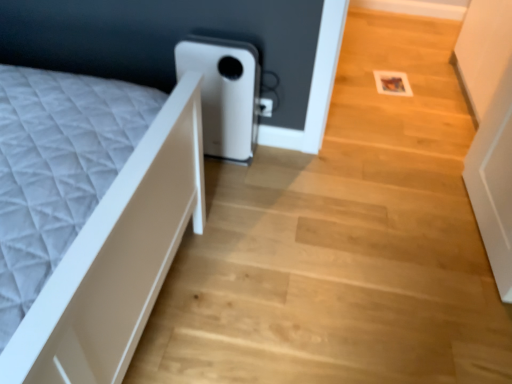
Describe the element at coordinates (343, 242) in the screenshot. I see `wooden floor at center` at that location.

Find the location of a particular element. wooden floor at center is located at coordinates (343, 242).

Find the location of a particular element. The width and height of the screenshot is (512, 384). white matte water heater at center is located at coordinates (224, 93).

The height and width of the screenshot is (384, 512). What do you see at coordinates (224, 93) in the screenshot? I see `white matte water heater at center` at bounding box center [224, 93].

Image resolution: width=512 pixels, height=384 pixels. Find the location of `wooden floor at center`. wooden floor at center is located at coordinates (343, 242).

Which object is positioned more to the left, white matte water heater at center or wooden floor at center?

white matte water heater at center.

In the scene shown: Considering their positions, is white matte water heater at center located in front of or behind wooden floor at center?

Clearly, white matte water heater at center is behind wooden floor at center.

Considering the points (220, 110) and (213, 346), which point is in front, point (220, 110) or point (213, 346)?

The point (213, 346) is closer.

From the image's perspective, is white matte water heater at center positioned above or below wooden floor at center?

Based on their image positions, white matte water heater at center is located above wooden floor at center.

From a real-world perspective, is white matte water heater at center positioned above or below wooden floor at center?

From a real-world perspective, white matte water heater at center is physically above wooden floor at center.

Looking at this image, in terms of width, does white matte water heater at center look wider or thinner when compared to wooden floor at center?

In the image, white matte water heater at center appears to be more narrow than wooden floor at center.

Which of these two, white matte water heater at center or wooden floor at center, stands shorter?

wooden floor at center is shorter.

Considering the sizes of objects white matte water heater at center and wooden floor at center in the image provided, who is smaller, white matte water heater at center or wooden floor at center?

Smaller between the two is white matte water heater at center.

Is white matte water heater at center inside or outside of wooden floor at center?

white matte water heater at center exists outside the volume of wooden floor at center.

Is white matte water heater at center not close to wooden floor at center?

Actually, white matte water heater at center and wooden floor at center are a little close together.

Looking at this image, could you tell me if white matte water heater at center is facing wooden floor at center?

No, white matte water heater at center is not facing towards wooden floor at center.

How many degrees apart are the facing directions of white matte water heater at center and wooden floor at center?

The facing directions of white matte water heater at center and wooden floor at center are 179 degrees apart.

Where is `water heater that is above the wooden floor at center (from a real-world perspective)`? This screenshot has height=384, width=512. water heater that is above the wooden floor at center (from a real-world perspective) is located at coordinates (224, 93).

Between wooden floor at center and white matte water heater at center, which one appears on the right side from the viewer's perspective?

wooden floor at center is more to the right.

Which object is more forward, wooden floor at center or white matte water heater at center?

Positioned in front is wooden floor at center.

Between point (483, 257) and point (257, 61), which one is positioned behind?

The point (257, 61) is more distant.

From the image's perspective, between wooden floor at center and white matte water heater at center, who is located below?

wooden floor at center, from the image's perspective.

From a real-world perspective, is wooden floor at center above or below white matte water heater at center?

wooden floor at center is situated lower than white matte water heater at center in the real world.

Considering the relative sizes of wooden floor at center and white matte water heater at center in the image provided, is wooden floor at center thinner than white matte water heater at center?

Incorrect, the width of wooden floor at center is not less than that of white matte water heater at center.

Considering the sizes of wooden floor at center and white matte water heater at center in the image, is wooden floor at center taller or shorter than white matte water heater at center?

In the image, wooden floor at center appears to be shorter than white matte water heater at center.

Is wooden floor at center smaller than white matte water heater at center?

No, wooden floor at center is not smaller than white matte water heater at center.

Is wooden floor at center completely or partially outside of white matte water heater at center?

Yes, wooden floor at center is located beyond the bounds of white matte water heater at center.

Is wooden floor at center next to white matte water heater at center?

No, wooden floor at center is not next to white matte water heater at center.

Does wooden floor at center turn towards white matte water heater at center?

No, wooden floor at center is not turned towards white matte water heater at center.

What's the angular difference between wooden floor at center and white matte water heater at center's facing directions?

The angular difference between wooden floor at center and white matte water heater at center is 179 degrees.

The height and width of the screenshot is (384, 512). I want to click on stairwell that appears below the white matte water heater at center (from the image's perspective), so click(343, 242).

Locate an element on the screen. The height and width of the screenshot is (384, 512). stairwell below the white matte water heater at center (from the image's perspective) is located at coordinates (343, 242).

Locate an element on the screen. The height and width of the screenshot is (384, 512). stairwell that appears below the white matte water heater at center (from a real-world perspective) is located at coordinates (343, 242).